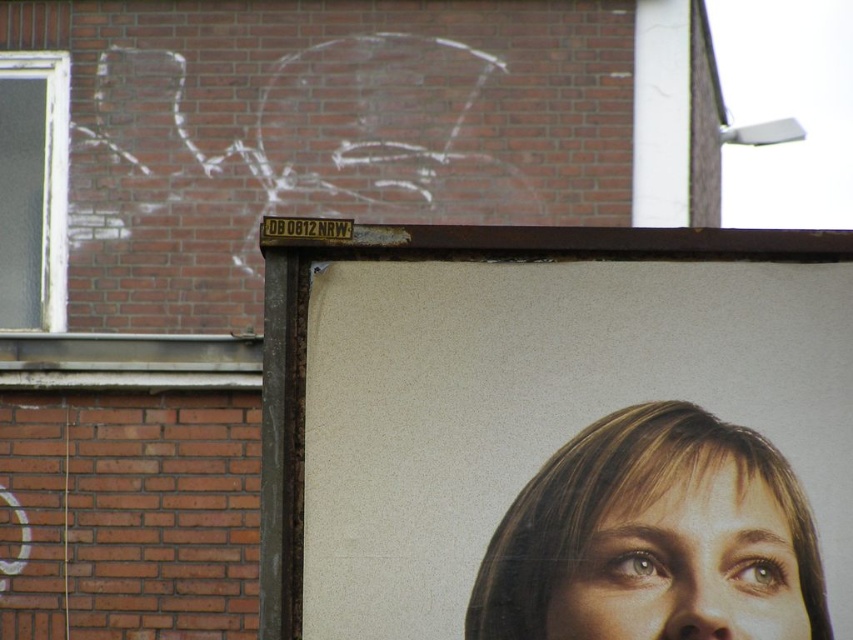
Question: Which point is farther from the camera taking this photo?

Choices:
 (A) (419, 278)
 (B) (701, 534)

Answer: (A)

Question: Can you confirm if smooth skin face at center is positioned to the right of matte paper poster at center?

Choices:
 (A) no
 (B) yes

Answer: (B)

Question: Does smooth skin face at center have a lesser width compared to matte paper poster at center?

Choices:
 (A) no
 (B) yes

Answer: (B)

Question: Which point appears farthest from the camera in this image?

Choices:
 (A) (653, 456)
 (B) (363, 301)

Answer: (B)

Question: Does smooth skin face at center lie behind matte paper poster at center?

Choices:
 (A) yes
 (B) no

Answer: (B)

Question: Which of the following is the farthest from the observer?

Choices:
 (A) smooth skin face at center
 (B) matte paper poster at center

Answer: (B)